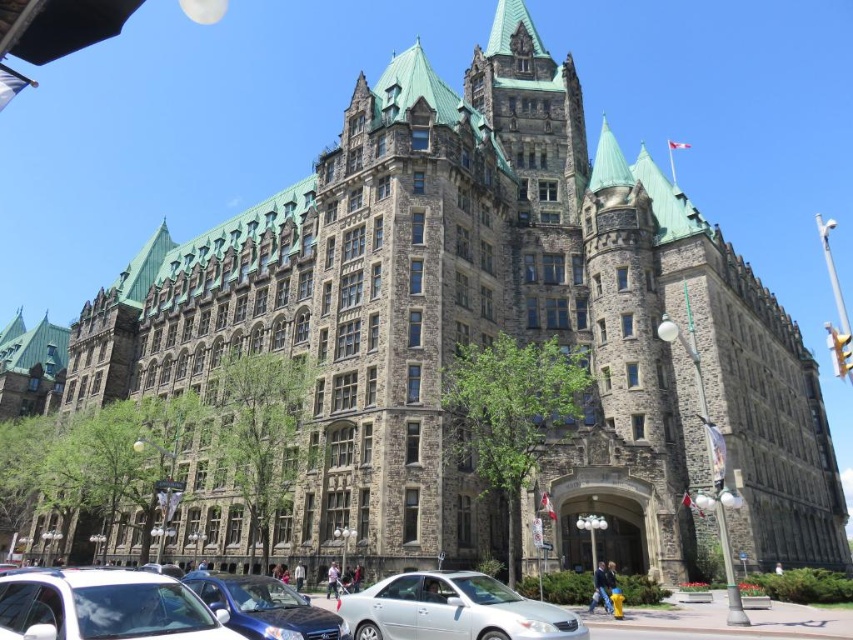
You are a delivery driver approaching the historic building and need to park your vehicle. You see a white glossy sedan at lower left and a metallic blue sedan at center. Which car is blocking your path to the parking spot closest to the entrance?

The white glossy sedan at lower left is blocking the path because it is positioned in front of the metallic blue sedan at center, making it harder to access the parking spot closest to the entrance.